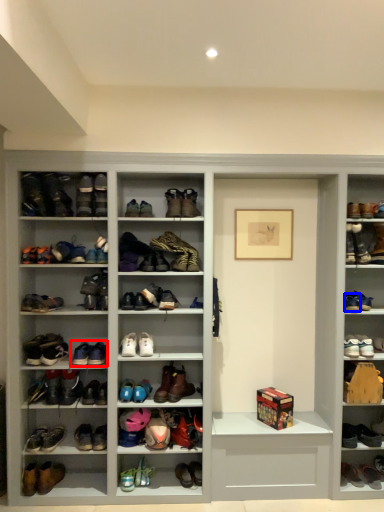
Question: Which object appears closest to the camera in this image, footwear (highlighted by a red box) or footwear (highlighted by a blue box)?

Choices:
 (A) footwear
 (B) footwear

Answer: (A)